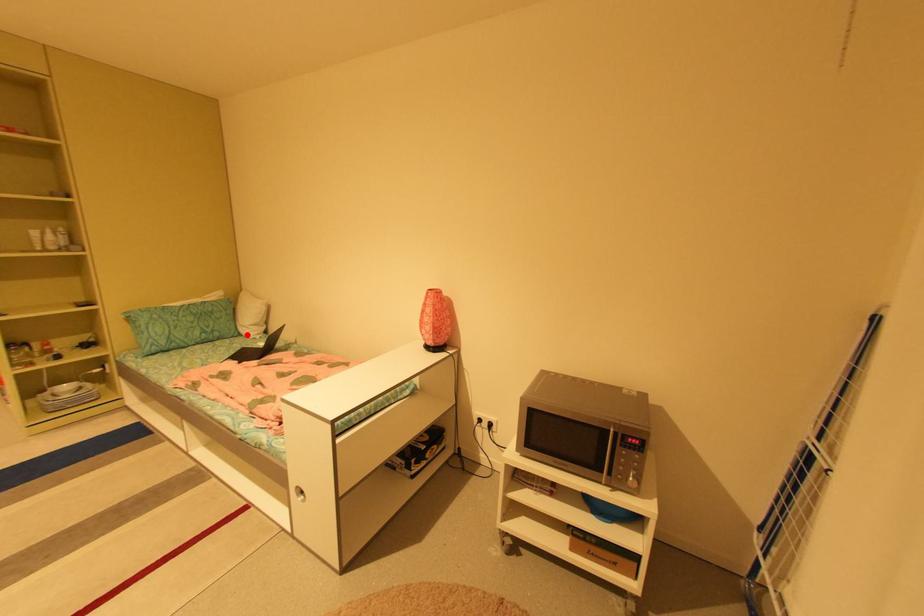
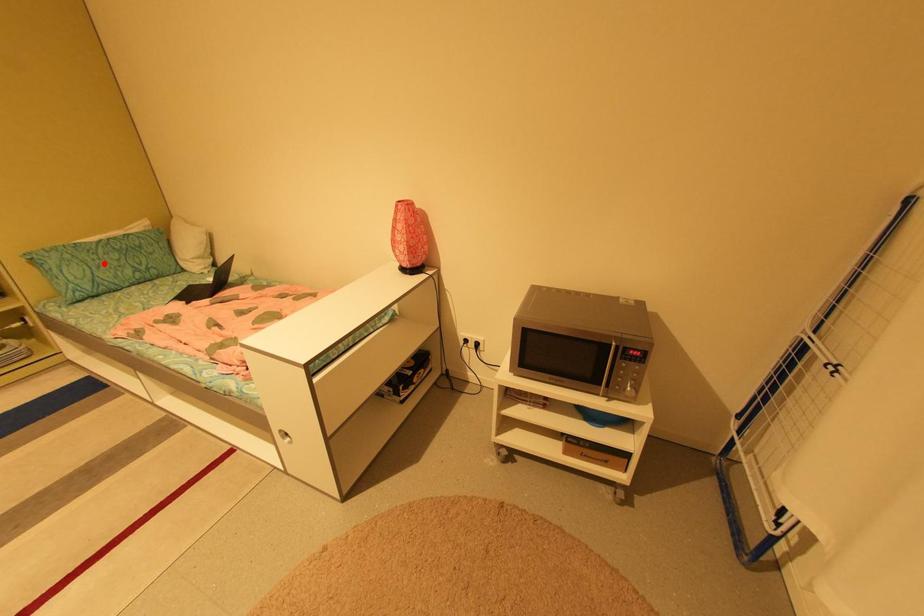
I am providing you with two images of the same scene from different viewpoints. A red point is marked on the first image and another point is marked on the second image. Is the marked point in image1 the same physical position as the marked point in image2?

No